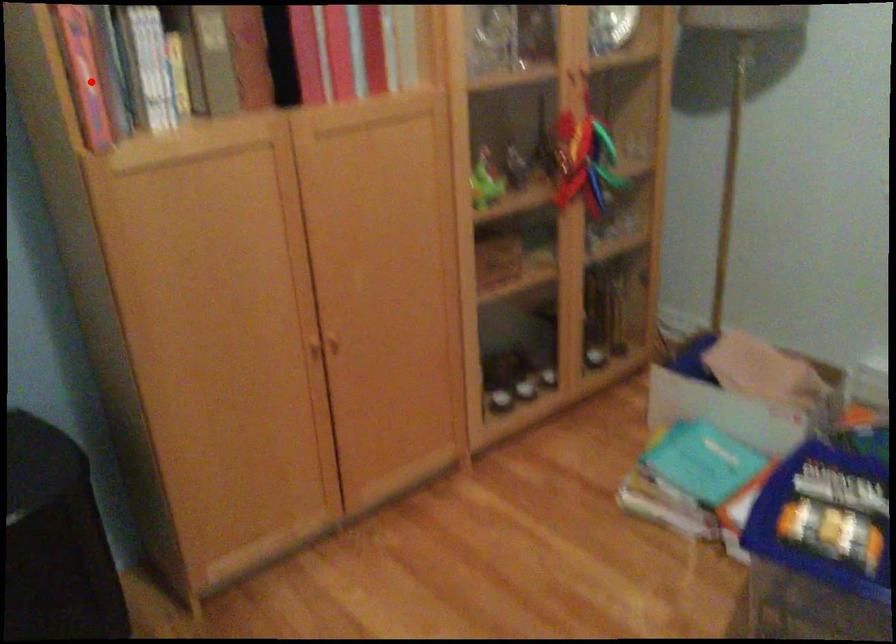
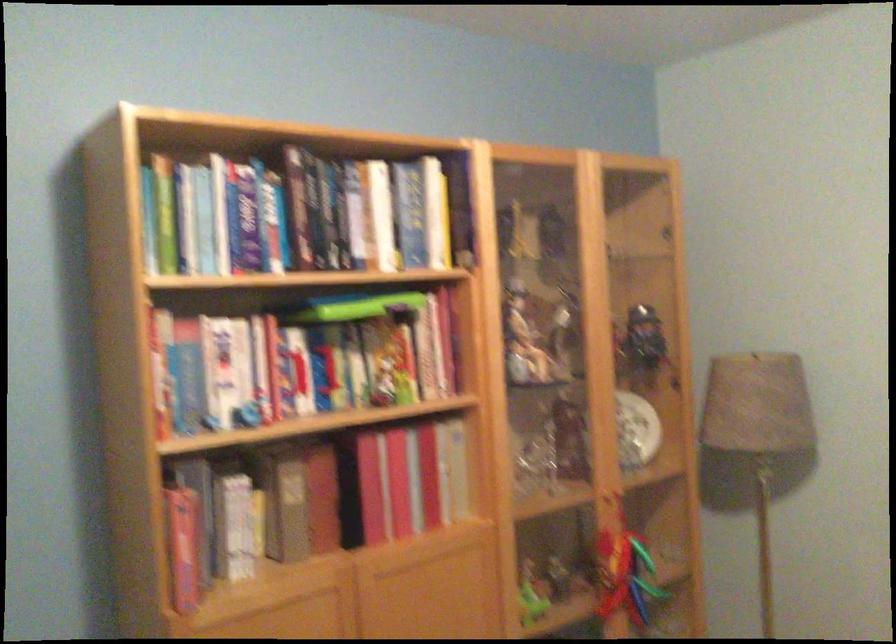
Find the pixel in the second image that matches the highlighted location in the first image.

(184, 544)